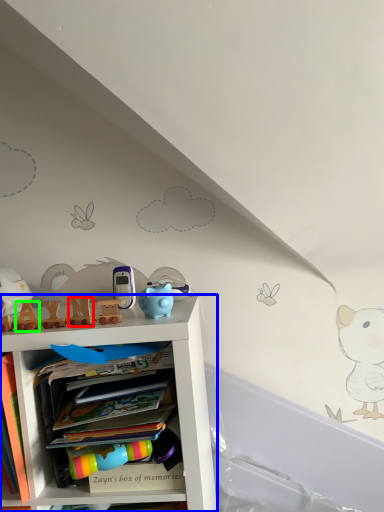
Question: Which object is the farthest from toy (highlighted by a red box)? Choose among these: shelf (highlighted by a blue box) or toy (highlighted by a green box).

Choices:
 (A) shelf
 (B) toy

Answer: (A)